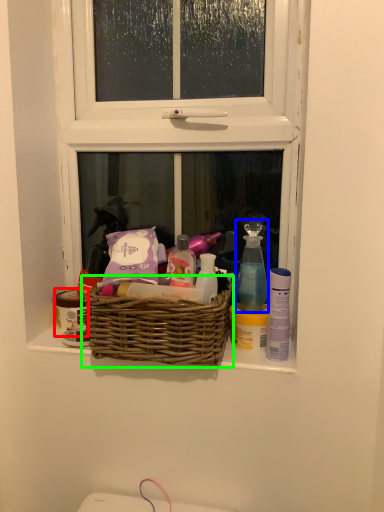
Question: Which is nearer to the toiletry (highlighted by a red box)? cleaning product (highlighted by a blue box) or picnic basket (highlighted by a green box).

Choices:
 (A) cleaning product
 (B) picnic basket

Answer: (B)